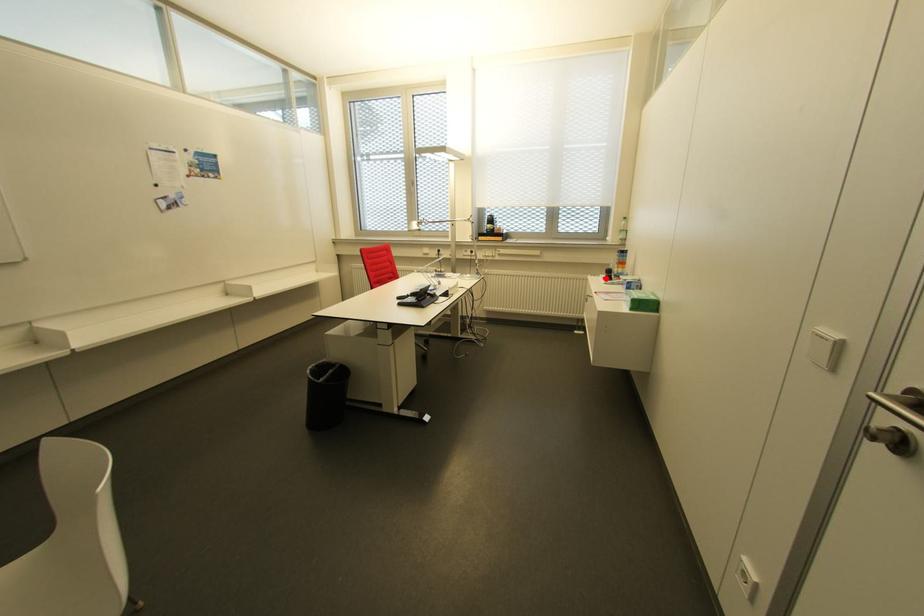
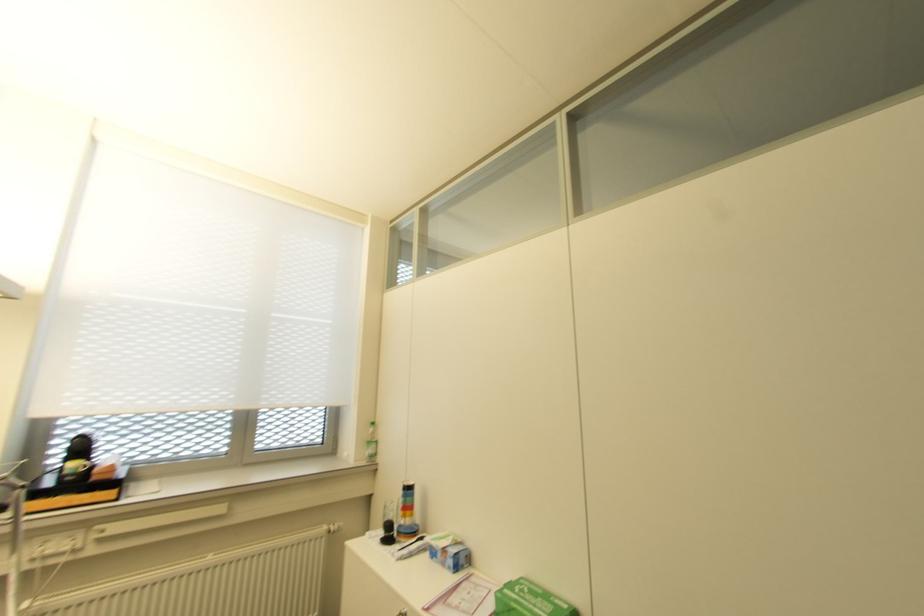
Question: I am providing you with two images of the same scene from different viewpoints. Image1 has a red point marked. In image2, the corresponding 3D location appears at what relative position? Reply with the corresponding letter.

Choices:
 (A) Closer
 (B) Farther

Answer: (B)